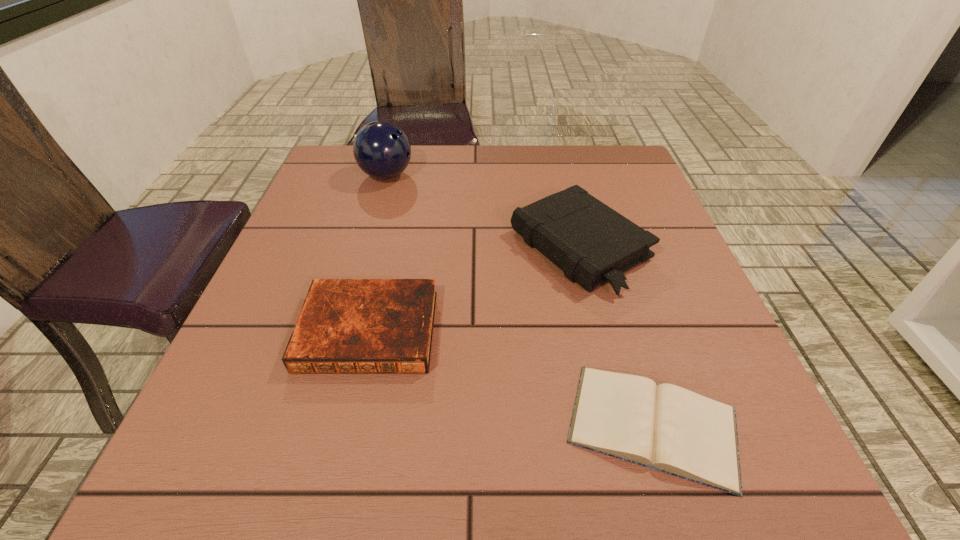
The image size is (960, 540). What are the coordinates of `free spot between the bowling ball and the third shortest object` in the screenshot? It's located at (483, 212).

Find the location of a particular element. This screenshot has width=960, height=540. vacant area between the farthest object and the leftmost Bible is located at coordinates (377, 253).

Where is `vacant space in between the shortest Bible and the second tallest object`? The width and height of the screenshot is (960, 540). vacant space in between the shortest Bible and the second tallest object is located at coordinates point(616,336).

Select which object is the third closest to the shortest Bible. Please provide its 2D coordinates. Your answer should be formatted as a tuple, i.e. [(x, y)], where the tuple contains the x and y coordinates of a point satisfying the conditions above.

[(382, 150)]

Where is `object that stands as the second closest to the tallest object`? The width and height of the screenshot is (960, 540). object that stands as the second closest to the tallest object is located at coordinates (346, 326).

Identify which Bible is the second closest to the second tallest Bible. Please provide its 2D coordinates. Your answer should be formatted as a tuple, i.e. [(x, y)], where the tuple contains the x and y coordinates of a point satisfying the conditions above.

[(665, 427)]

I want to click on Bible that is the second closest to the tallest Bible, so click(x=346, y=326).

Find the location of a particular element. The image size is (960, 540). vacant space that satisfies the following two spatial constraints: 1. on the spine side of the shortest object; 2. on the right side of the third tallest object is located at coordinates (347, 425).

You are a GUI agent. You are given a task and a screenshot of the screen. Output one action in this format:
    pyautogui.click(x=<x>, y=<y>)
    Task: Click on the vacant region that satisfies the following two spatial constraints: 1. on the surface of the farthest object near the finger holes; 2. on the right side of the shortest object
    This screenshot has width=960, height=540.
    Given the screenshot: What is the action you would take?
    pyautogui.click(x=315, y=425)

Locate an element on the screen. free space that satisfies the following two spatial constraints: 1. on the surface of the bowling ball near the finger holes; 2. on the left side of the shortest object is located at coordinates (315, 425).